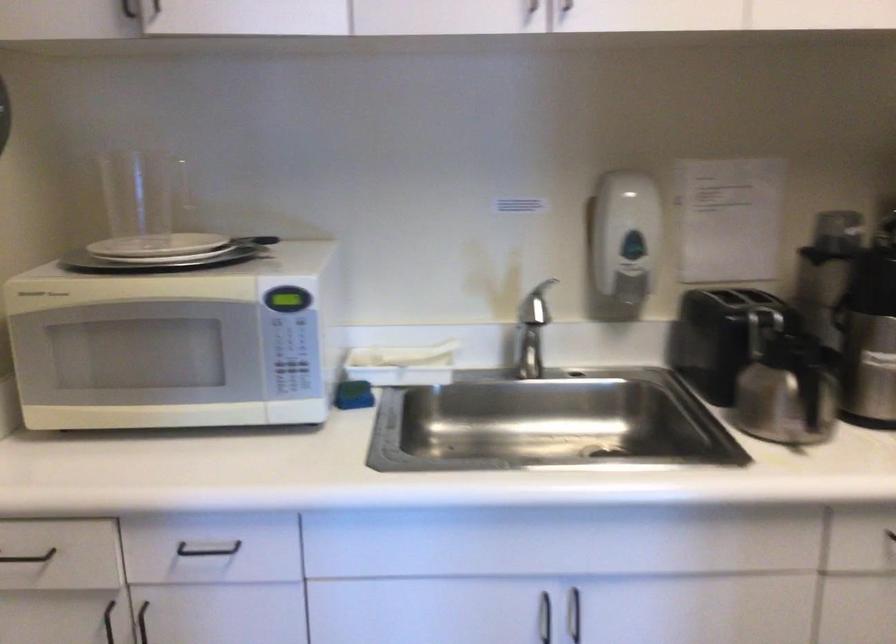
First-person continuous shooting, in which direction is the camera rotating?

The camera's rotation is toward right-down.